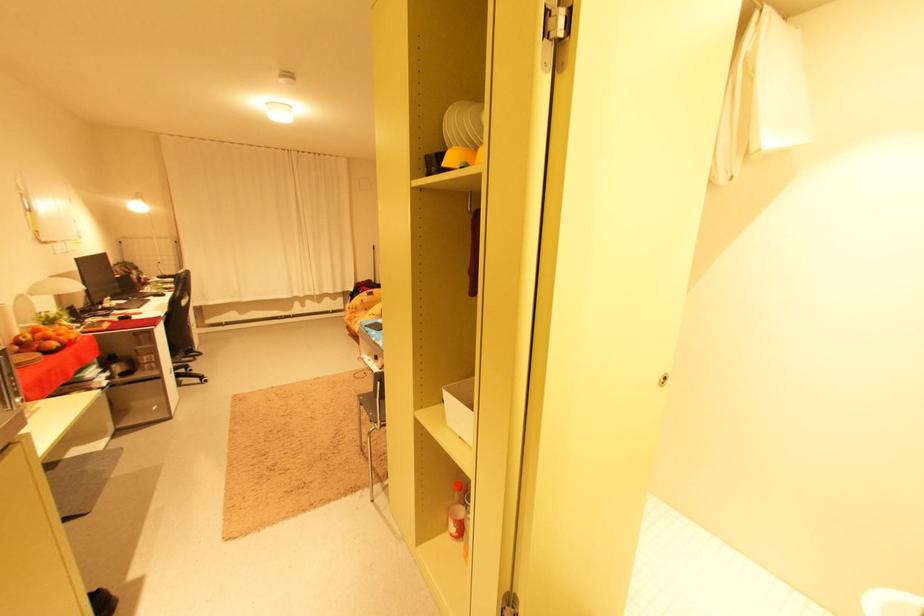
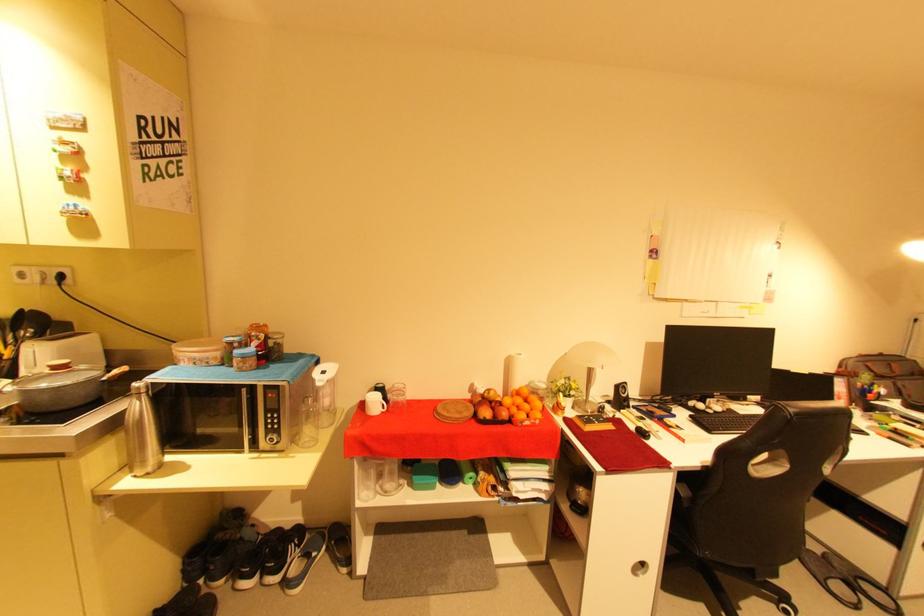
Question: I am providing you with two images of the same scene from different viewpoints. Given a red point in image1, look at the same physical point in image2. Is it:

Choices:
 (A) Closer to the viewpoint
 (B) Farther from the viewpoint

Answer: (A)